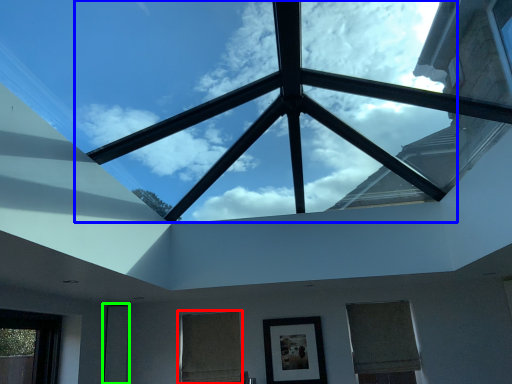
Question: Based on their relative distances, which object is nearer to window (highlighted by a red box)? Choose from cloud (highlighted by a blue box) and glass door (highlighted by a green box).

Choices:
 (A) cloud
 (B) glass door

Answer: (B)